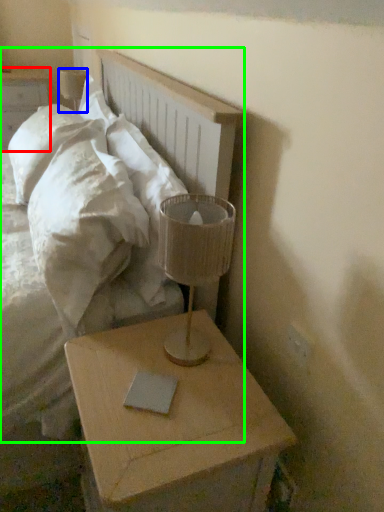
Question: Estimate the real-world distances between objects in this image. Which object is farther from nightstand (highlighted by a red box), table lamp (highlighted by a blue box) or bed (highlighted by a green box)?

Choices:
 (A) table lamp
 (B) bed

Answer: (B)